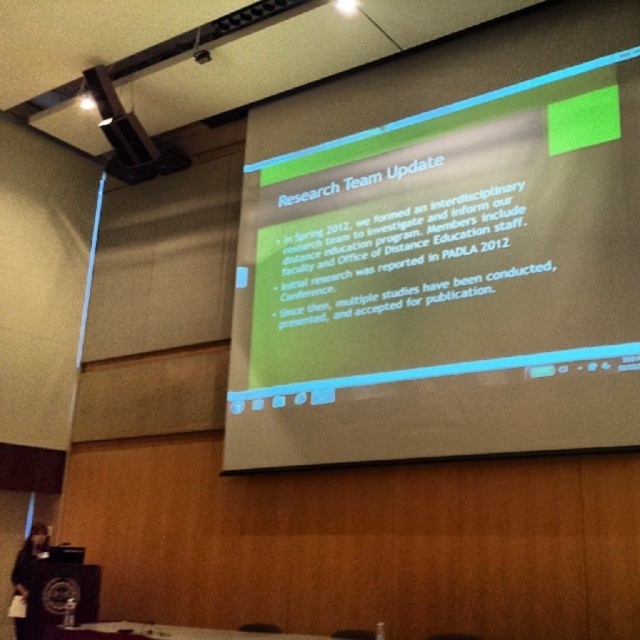
Question: Which point is farther to the camera?

Choices:
 (A) white glossy table at lower center
 (B) black fabric at lower left

Answer: (B)

Question: Which point appears farthest from the camera in this image?

Choices:
 (A) (257, 636)
 (B) (44, 524)

Answer: (B)

Question: Which object is closer to the camera taking this photo?

Choices:
 (A) black fabric at lower left
 (B) green matte projector screen at upper center

Answer: (B)

Question: Does white glossy table at lower center lie in front of black fabric at lower left?

Choices:
 (A) yes
 (B) no

Answer: (A)

Question: Does green matte projector screen at upper center have a larger size compared to black fabric at lower left?

Choices:
 (A) yes
 (B) no

Answer: (A)

Question: Can you confirm if white glossy table at lower center is wider than black fabric at lower left?

Choices:
 (A) yes
 (B) no

Answer: (A)